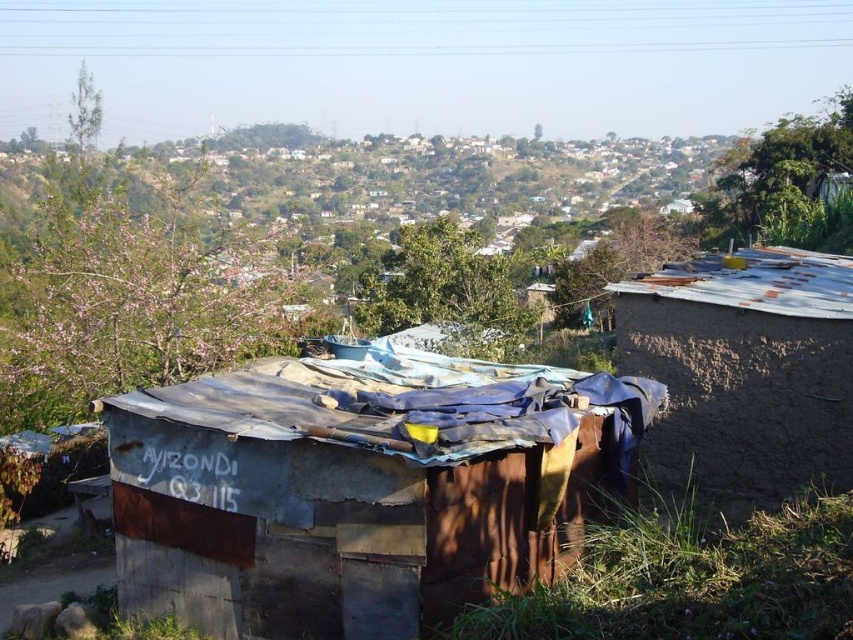
Question: Is rusty corrugated hut at center closer to camera compared to brown mud hut at right?

Choices:
 (A) yes
 (B) no

Answer: (A)

Question: Does rusty corrugated hut at center come behind brown mud hut at right?

Choices:
 (A) no
 (B) yes

Answer: (A)

Question: Can you confirm if rusty corrugated hut at center is positioned below brown mud hut at right?

Choices:
 (A) yes
 (B) no

Answer: (A)

Question: Among these objects, which one is nearest to the camera?

Choices:
 (A) rusty corrugated hut at center
 (B) brown mud hut at right

Answer: (A)